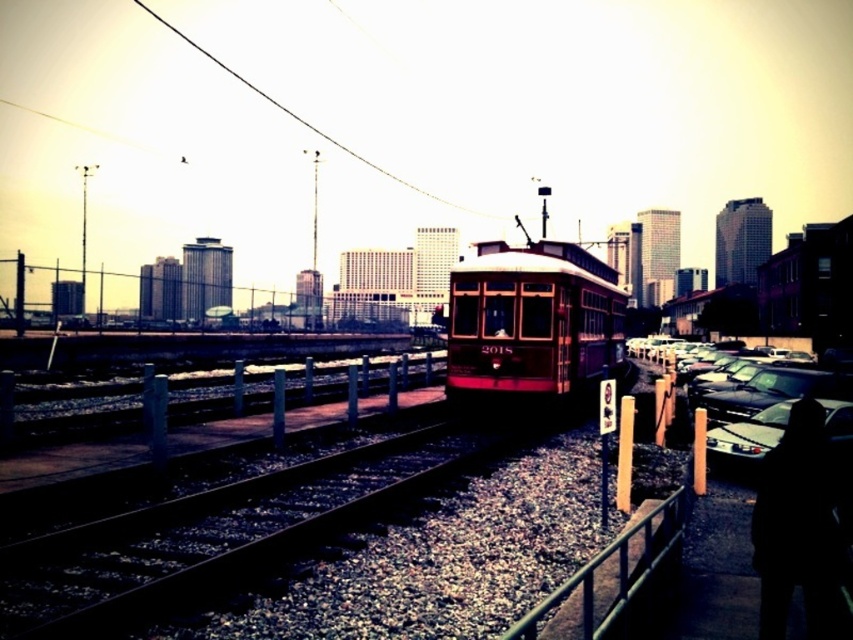
Where is `metal/rustic rail at lower center`? metal/rustic rail at lower center is located at coordinates (608, 577).

Does metal/rustic rail at lower center have a lesser width compared to black wire at upper center?

Yes.

This screenshot has width=853, height=640. What are the coordinates of `metal/rustic rail at lower center` in the screenshot? It's located at (608, 577).

Is shiny red trolley at center closer to the viewer compared to shiny black sedan at right?

No.

The image size is (853, 640). I want to click on shiny red trolley at center, so coord(532,321).

Does point (486, 372) come in front of point (595, 561)?

No, (486, 372) is behind (595, 561).

Can you confirm if shiny red trolley at center is wider than metal/rustic rail at lower center?

Yes.

Is point (596, 378) closer to camera compared to point (637, 548)?

No, (596, 378) is behind (637, 548).

This screenshot has height=640, width=853. I want to click on shiny red trolley at center, so click(x=532, y=321).